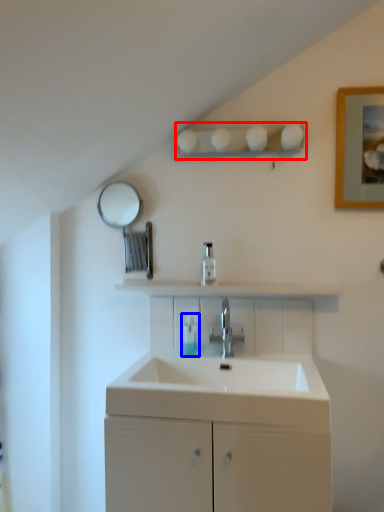
Question: Among these objects, which one is nearest to the camera, shelf (highlighted by a red box) or toiletry (highlighted by a blue box)?

Choices:
 (A) shelf
 (B) toiletry

Answer: (A)